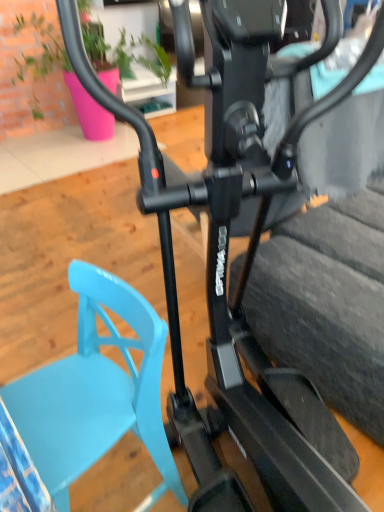
Question: Does matte green plant at upper center have a smaller size compared to black rubber tire at center?

Choices:
 (A) no
 (B) yes

Answer: (A)

Question: Are matte green plant at upper center and black rubber tire at center located far from each other?

Choices:
 (A) yes
 (B) no

Answer: (A)

Question: Can black rubber tire at center be found inside matte green plant at upper center?

Choices:
 (A) yes
 (B) no

Answer: (B)

Question: Is matte green plant at upper center further to the viewer compared to black rubber tire at center?

Choices:
 (A) no
 (B) yes

Answer: (B)

Question: Is black rubber tire at center at the back of matte green plant at upper center?

Choices:
 (A) yes
 (B) no

Answer: (B)

Question: Is matte green plant at upper center bigger than black rubber tire at center?

Choices:
 (A) yes
 (B) no

Answer: (A)

Question: Is light blue plastic swivel chair at lower left far from matte green plant at upper center?

Choices:
 (A) no
 (B) yes

Answer: (B)

Question: Is light blue plastic swivel chair at lower left aimed at matte green plant at upper center?

Choices:
 (A) no
 (B) yes

Answer: (A)

Question: Does light blue plastic swivel chair at lower left contain matte green plant at upper center?

Choices:
 (A) yes
 (B) no

Answer: (B)

Question: Is light blue plastic swivel chair at lower left positioned with its back to matte green plant at upper center?

Choices:
 (A) yes
 (B) no

Answer: (B)

Question: Are light blue plastic swivel chair at lower left and matte green plant at upper center beside each other?

Choices:
 (A) yes
 (B) no

Answer: (B)

Question: From a real-world perspective, is light blue plastic swivel chair at lower left on matte green plant at upper center?

Choices:
 (A) no
 (B) yes

Answer: (A)

Question: Does light blue plastic swivel chair at lower left appear on the left side of black rubber tire at center?

Choices:
 (A) yes
 (B) no

Answer: (A)